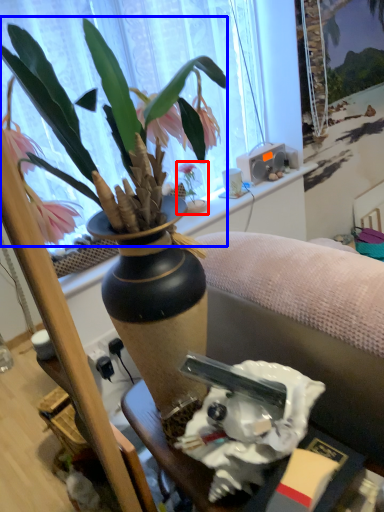
Question: Which point is closer to the camera, houseplant (highlighted by a red box) or flower (highlighted by a blue box)?

Choices:
 (A) houseplant
 (B) flower

Answer: (B)